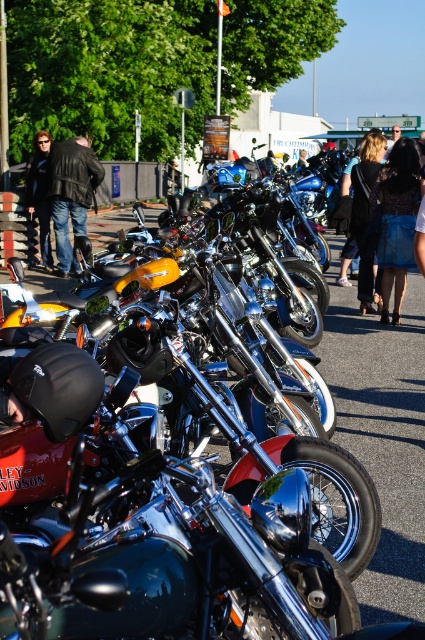
You are a motorcycle enthusiast at the FRUCHTMARKT event. You see the shiny asphalt pavement at center and the dark brown leather jacket at center. Which object takes up more space in the image?

The shiny asphalt pavement at center is larger in size than the dark brown leather jacket at center, so the shiny asphalt pavement at center takes up more space in the image.

You are standing at the FRUCHTMARKT motorcycle event and want to take a photo of both the point at coordinates (172,445) and the point at coordinates (368,148). Which point should you focus on first to ensure both are in focus?

You should focus on the point at coordinates (172,445) first because it is closer to the camera. Since it is closer, focusing on it will ensure the farther point at (368,148) is also in focus due to the depth of field.